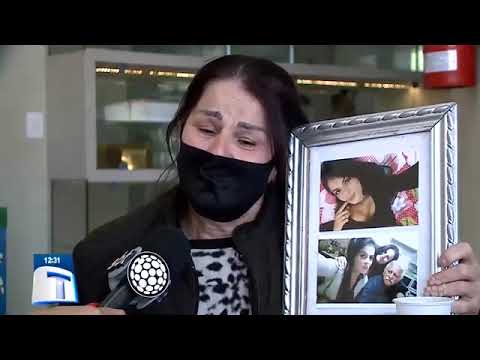
Locate an element on the screen. This screenshot has width=480, height=360. switch is located at coordinates (36, 129).